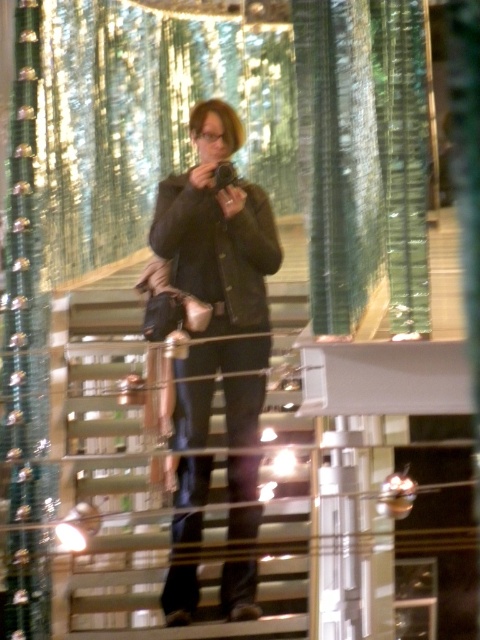
Based on the photo, between metallic silver stairwell at center and matte black jacket at center, which one has more height?

matte black jacket at center is taller.

Is metallic silver stairwell at center wider than matte black jacket at center?

No.

Locate an element on the screen. Image resolution: width=480 pixels, height=640 pixels. metallic silver stairwell at center is located at coordinates (164, 493).